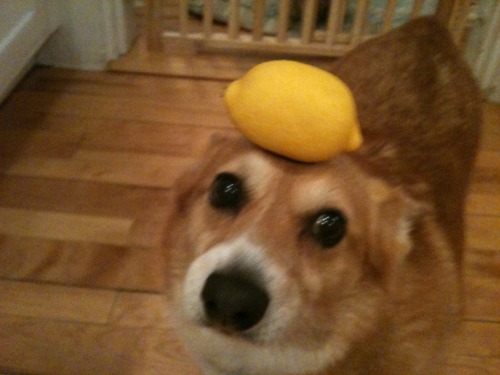
You are a GUI agent. You are given a task and a screenshot of the screen. Output one action in this format:
    pyautogui.click(x=<x>, y=<y>)
    Task: Click on the baby gate
    
    Given the screenshot: What is the action you would take?
    pyautogui.click(x=183, y=17), pyautogui.click(x=326, y=47), pyautogui.click(x=459, y=11)